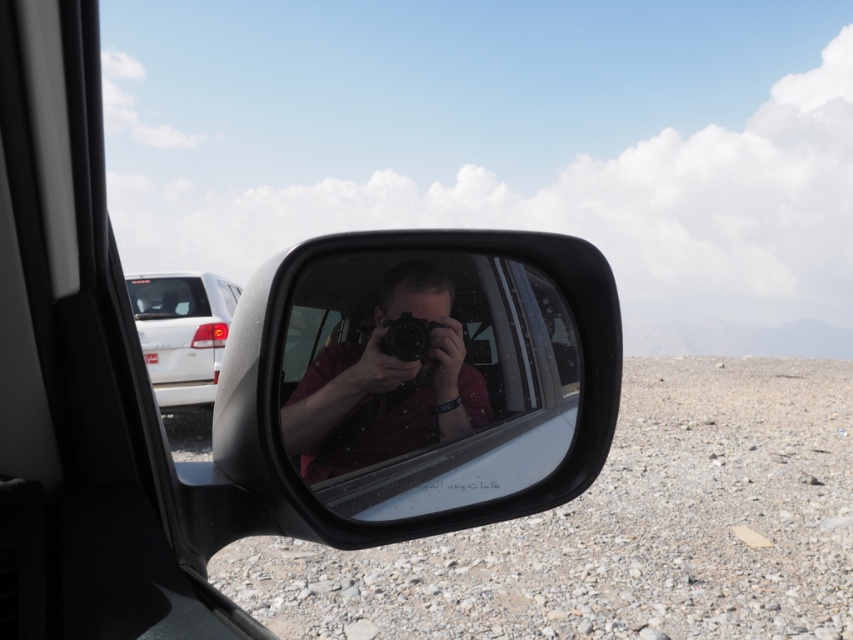
Question: Estimate the real-world distances between objects in this image. Which object is closer to the black plastic car mirror at center?

Choices:
 (A) black plastic camera at center
 (B) white glossy sedan at upper left
 (C) clear glass car window at upper left
 (D) matte black camera at center

Answer: (D)

Question: Which of the following is the closest to the observer?

Choices:
 (A) clear glass car window at upper left
 (B) white glossy sedan at upper left

Answer: (B)

Question: Does black plastic car mirror at center have a lesser width compared to white glossy sedan at upper left?

Choices:
 (A) no
 (B) yes

Answer: (B)

Question: Does clear glass car window at upper left have a greater width compared to black plastic camera at center?

Choices:
 (A) yes
 (B) no

Answer: (A)

Question: Does matte black camera at center have a smaller size compared to clear glass car window at upper left?

Choices:
 (A) no
 (B) yes

Answer: (B)

Question: Which is farther from the black plastic car mirror at center?

Choices:
 (A) clear glass car window at upper left
 (B) matte black camera at center
 (C) black plastic camera at center

Answer: (A)